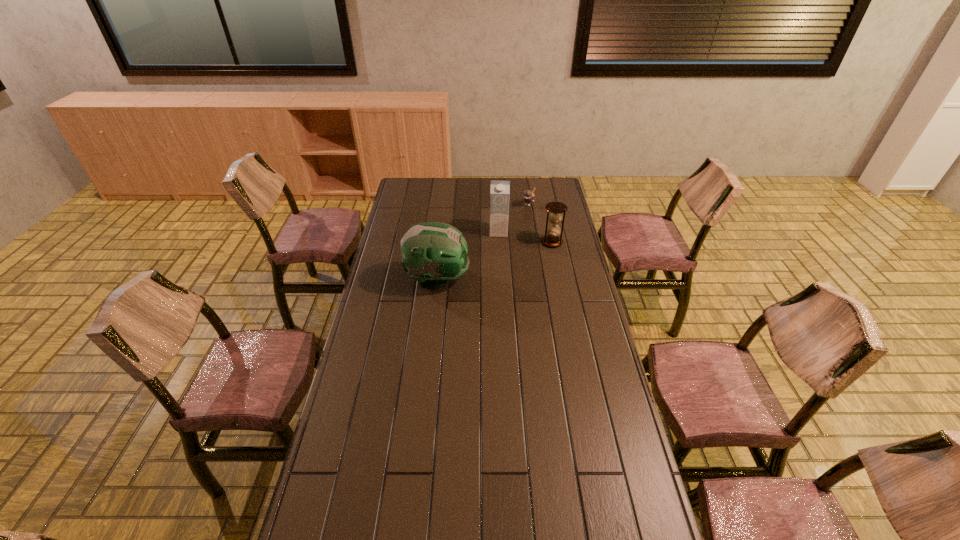
Identify the location of unoccupied area between the kitten and the hourglass. This screenshot has height=540, width=960. (540, 222).

The image size is (960, 540). I want to click on empty space that is in between the football helmet and the second object from left to right, so click(x=468, y=256).

Locate an element on the screen. This screenshot has height=540, width=960. free spot between the kitten and the nearest object is located at coordinates pyautogui.click(x=483, y=241).

This screenshot has width=960, height=540. I want to click on vacant area that lies between the nearest object and the third tallest object, so click(494, 261).

What are the coordinates of `empty space that is in between the hourglass and the kitten` in the screenshot? It's located at (540, 222).

Locate which object ranks in proximity to the farthest object. Please provide its 2D coordinates. Your answer should be formatted as a tuple, i.e. [(x, y)], where the tuple contains the x and y coordinates of a point satisfying the conditions above.

[(500, 190)]

You are a GUI agent. You are given a task and a screenshot of the screen. Output one action in this format:
    pyautogui.click(x=<x>, y=<y>)
    Task: Click on the third closest object to the nearest object
    The image size is (960, 540).
    Given the screenshot: What is the action you would take?
    pyautogui.click(x=529, y=196)

I want to click on free space that satisfies the following two spatial constraints: 1. on the front side of the third object from right to left; 2. on the left side of the second shortest object, so click(x=499, y=242).

Locate an element on the screen. free location that satisfies the following two spatial constraints: 1. on the back side of the kitten; 2. on the right side of the carton is located at coordinates (497, 203).